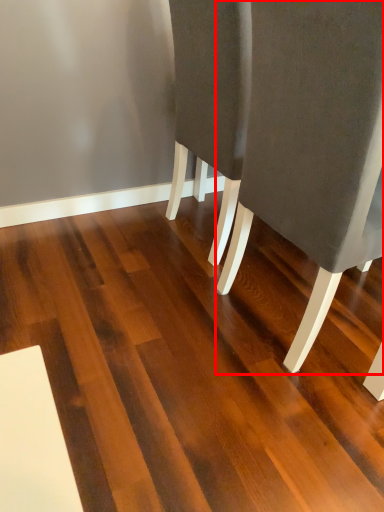
Question: From the image's perspective, considering the relative positions of chair (annotated by the red box) and hardwood in the image provided, where is chair (annotated by the red box) located with respect to the staircase?

Choices:
 (A) below
 (B) above

Answer: (B)